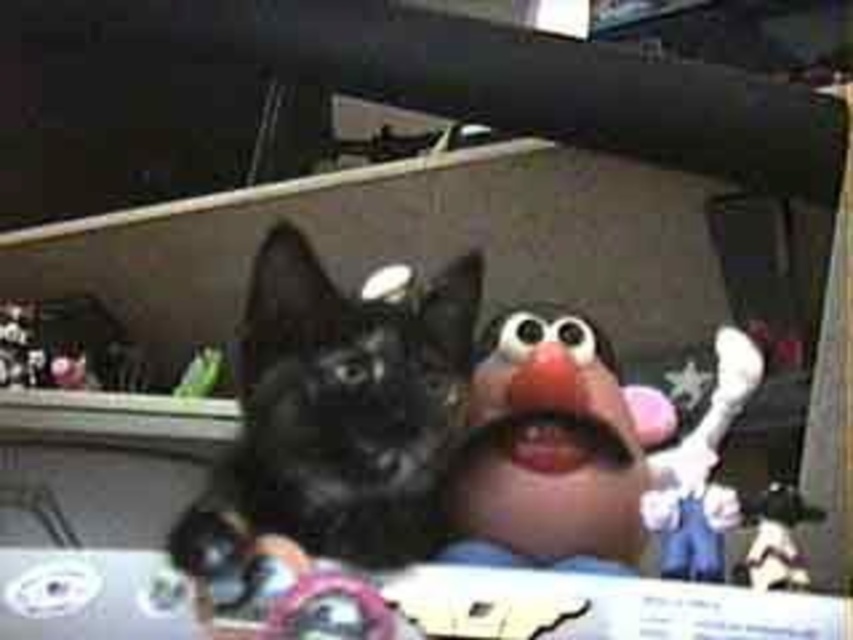
You are a toy designer who needs to create a storage box for both the black fur cat at center and the matte plastic puppet at center. What is the minimum width of the box required to fit both items side by side?

The minimum width of the box should be at least 3.45 inches to accommodate both the black fur cat at center and the matte plastic puppet at center side by side.

You are a photographer trying to capture a clear photo of the matte plastic puppet at center. However, the black fur cat at center is blocking your view. Can you adjust your position to take the photo without moving the cat?

The black fur cat at center is positioned over the matte plastic puppet at center, so you would need to move slightly to the side or lower your camera angle to capture the puppet without the cat blocking it.